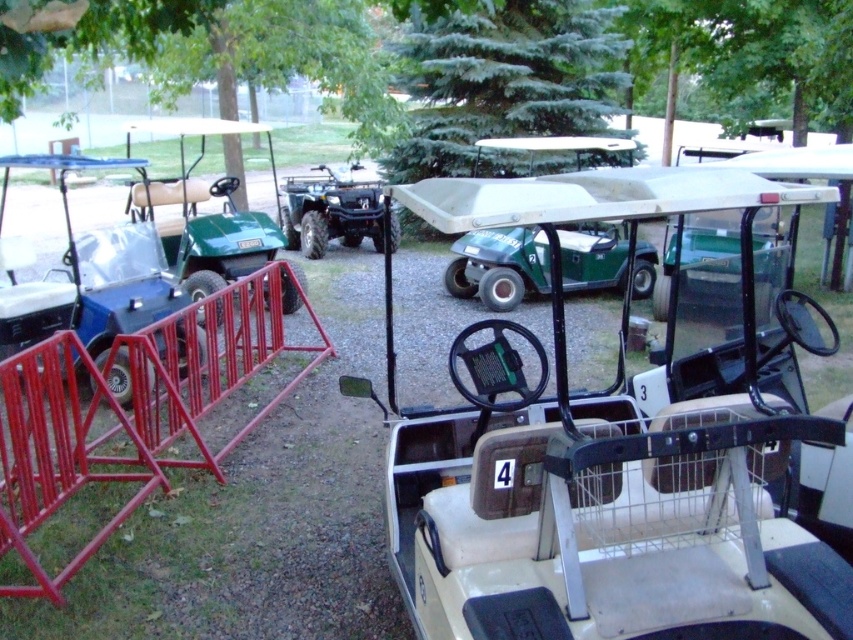
Question: Is white matte golf cart at center thinner than matte black golf cart at left?

Choices:
 (A) yes
 (B) no

Answer: (B)

Question: Which object appears farthest from the camera in this image?

Choices:
 (A) green matte golf cart at left
 (B) white matte golf cart at center
 (C) matte black golf cart at left

Answer: (A)

Question: Is white matte golf cart at center below matte black golf cart at left?

Choices:
 (A) no
 (B) yes

Answer: (B)

Question: Which point appears farthest from the camera in this image?

Choices:
 (A) (70, 264)
 (B) (212, 237)

Answer: (B)

Question: Which of the following is the farthest from the observer?

Choices:
 (A) green matte golf cart at left
 (B) white matte golf cart at center

Answer: (A)

Question: Does matte black golf cart at left lie behind green matte golf cart at left?

Choices:
 (A) no
 (B) yes

Answer: (A)